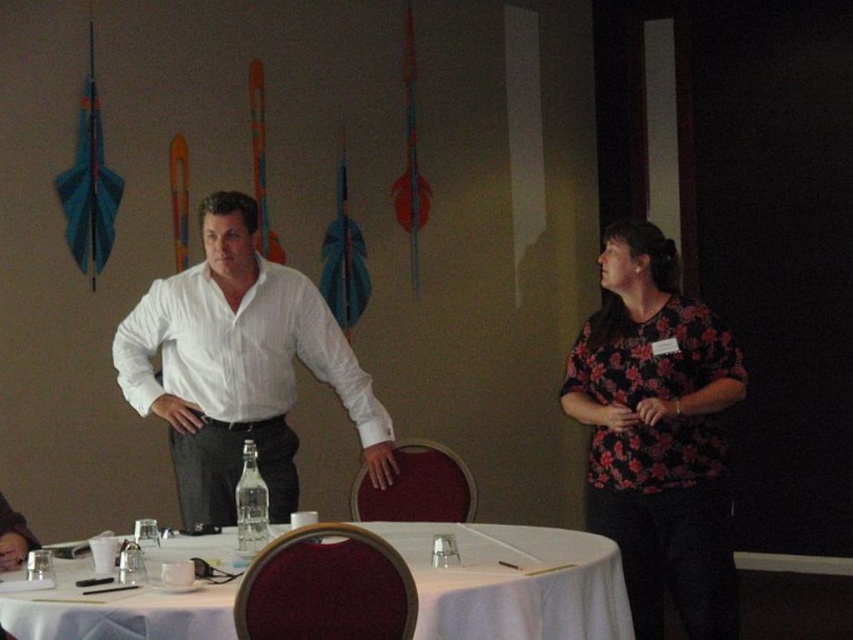
Question: Is floral print blouse at center thinner than white striped shirt at center?

Choices:
 (A) yes
 (B) no

Answer: (A)

Question: Which point is closer to the camera?

Choices:
 (A) (62, 573)
 (B) (206, 307)

Answer: (A)

Question: Which of the following is the farthest from the observer?

Choices:
 (A) white striped shirt at center
 (B) floral print blouse at center

Answer: (A)

Question: Considering the real-world distances, which object is farthest from the white fabric table at center?

Choices:
 (A) floral print blouse at center
 (B) white striped shirt at center

Answer: (B)

Question: From the image, what is the correct spatial relationship of floral print blouse at center in relation to white fabric table at center?

Choices:
 (A) right
 (B) left

Answer: (A)

Question: Considering the relative positions of floral print blouse at center and white fabric table at center in the image provided, where is floral print blouse at center located with respect to white fabric table at center?

Choices:
 (A) left
 (B) right

Answer: (B)